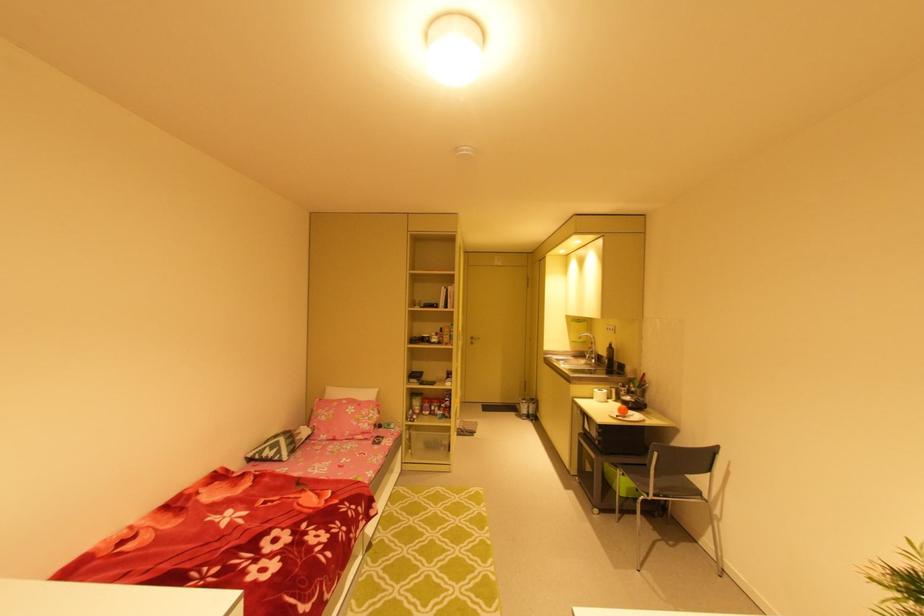
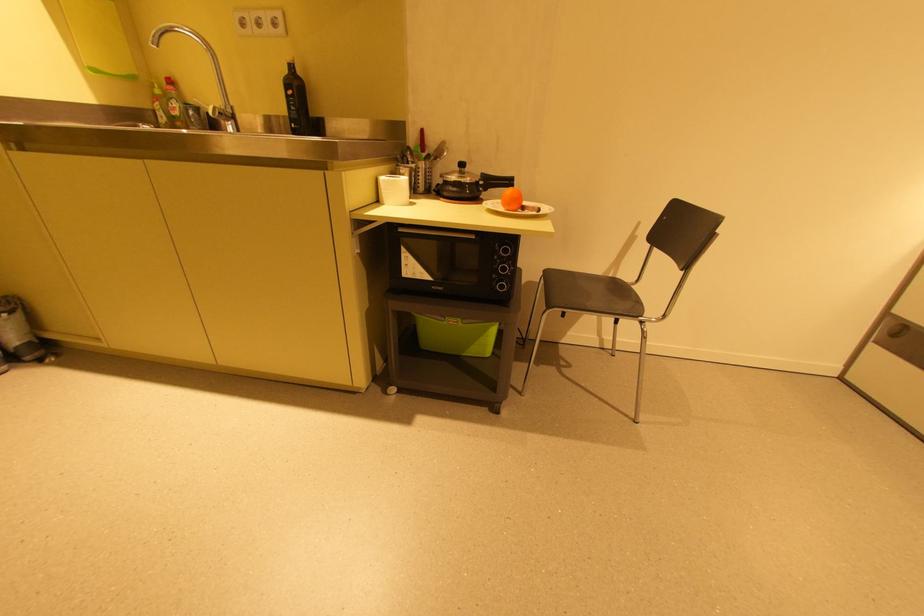
Find the pixel in the second image that matches (613,346) in the first image.

(289, 71)